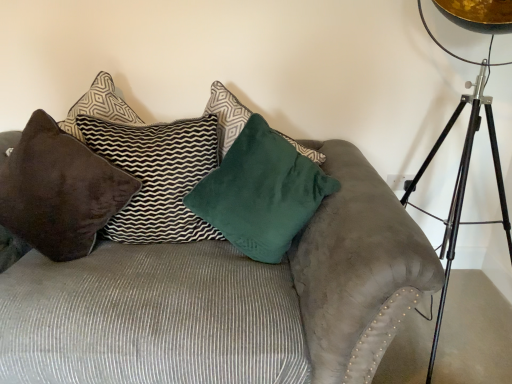
Question: Considering the relative sizes of velvet brown pillow at left, the first pillow viewed from the left, and velvet brown pillow at upper left, which ranks as the 2th pillow in left-to-right order, in the image provided, is velvet brown pillow at left, the first pillow viewed from the left, thinner than velvet brown pillow at upper left, which ranks as the 2th pillow in left-to-right order,?

Choices:
 (A) no
 (B) yes

Answer: (A)

Question: Can you confirm if velvet brown pillow at left, which is the 3th pillow in right-to-left order, is positioned to the left of velvet brown pillow at upper left, the second pillow when ordered from right to left?

Choices:
 (A) yes
 (B) no

Answer: (A)

Question: From a real-world perspective, is velvet brown pillow at left, which is the 3th pillow in right-to-left order, on velvet brown pillow at upper left, the second pillow when ordered from right to left?

Choices:
 (A) no
 (B) yes

Answer: (A)

Question: Can you confirm if velvet brown pillow at left, the first pillow viewed from the left, is positioned to the right of velvet brown pillow at upper left, which ranks as the 2th pillow in left-to-right order?

Choices:
 (A) yes
 (B) no

Answer: (B)

Question: Is velvet brown pillow at left, the first pillow viewed from the left, oriented towards velvet brown pillow at upper left, which ranks as the 2th pillow in left-to-right order?

Choices:
 (A) no
 (B) yes

Answer: (A)

Question: Is velvet brown pillow at left, which is the 3th pillow in right-to-left order, wider than velvet brown pillow at upper left, which ranks as the 2th pillow in left-to-right order?

Choices:
 (A) no
 (B) yes

Answer: (B)

Question: Can you confirm if velvet green pillow at center, which is counted as the 1th pillow, starting from the right, is smaller than velvet brown pillow at left, the first pillow viewed from the left?

Choices:
 (A) no
 (B) yes

Answer: (B)

Question: Can you confirm if velvet green pillow at center, which is counted as the 1th pillow, starting from the right, is positioned to the right of velvet brown pillow at left, which is the 3th pillow in right-to-left order?

Choices:
 (A) yes
 (B) no

Answer: (A)

Question: Could you tell me if velvet green pillow at center, which is counted as the 1th pillow, starting from the right, is turned towards velvet brown pillow at left, the first pillow viewed from the left?

Choices:
 (A) yes
 (B) no

Answer: (B)

Question: From the image's perspective, is velvet green pillow at center, which is counted as the 1th pillow, starting from the right, over velvet brown pillow at left, which is the 3th pillow in right-to-left order?

Choices:
 (A) no
 (B) yes

Answer: (A)

Question: Is velvet green pillow at center, the 3th pillow positioned from the left, to the left of velvet brown pillow at left, which is the 3th pillow in right-to-left order, from the viewer's perspective?

Choices:
 (A) no
 (B) yes

Answer: (A)

Question: Is velvet green pillow at center, the 3th pillow positioned from the left, turned away from velvet brown pillow at left, the first pillow viewed from the left?

Choices:
 (A) no
 (B) yes

Answer: (A)

Question: Is velvet brown pillow at upper left, which ranks as the 2th pillow in left-to-right order, placed right next to suede couch at center?

Choices:
 (A) yes
 (B) no

Answer: (B)